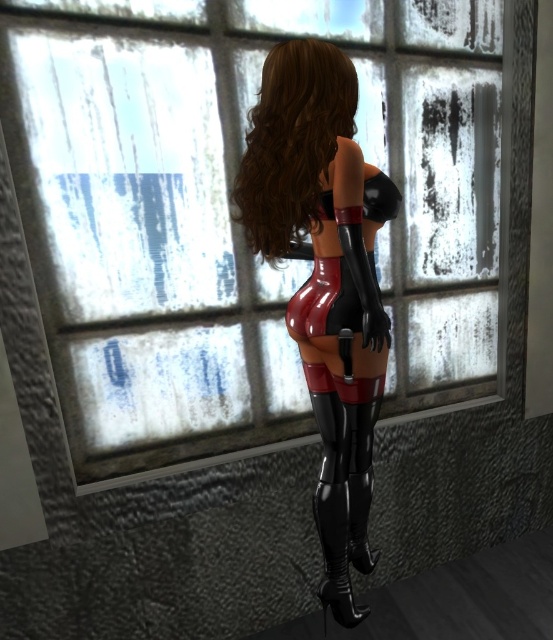
Is clear glass window at center to the right of shiny brown hair at center from the viewer's perspective?

Indeed, clear glass window at center is positioned on the right side of shiny brown hair at center.

Measure the distance from clear glass window at center to shiny brown hair at center.

clear glass window at center is 16.13 inches away from shiny brown hair at center.

Is point (58, 212) closer to camera compared to point (346, 97)?

That is False.

This screenshot has width=553, height=640. What are the coordinates of `clear glass window at center` in the screenshot? It's located at (232, 220).

Identify the location of shiny brown hair at center. (293, 144).

Does shiny brown hair at center have a greater height compared to black patent leather boot at lower center?

Yes.

I want to click on shiny brown hair at center, so click(293, 144).

This screenshot has width=553, height=640. Identify the location of shiny brown hair at center. (293, 144).

Does clear glass window at center have a lesser width compared to black patent leather boot at lower center?

No, clear glass window at center is not thinner than black patent leather boot at lower center.

Can you confirm if clear glass window at center is positioned to the left of black patent leather boot at lower center?

Yes, clear glass window at center is to the left of black patent leather boot at lower center.

Measure the distance between point (x=92, y=120) and camera.

Point (x=92, y=120) and camera are 5.91 feet apart.

Image resolution: width=553 pixels, height=640 pixels. I want to click on clear glass window at center, so 232,220.